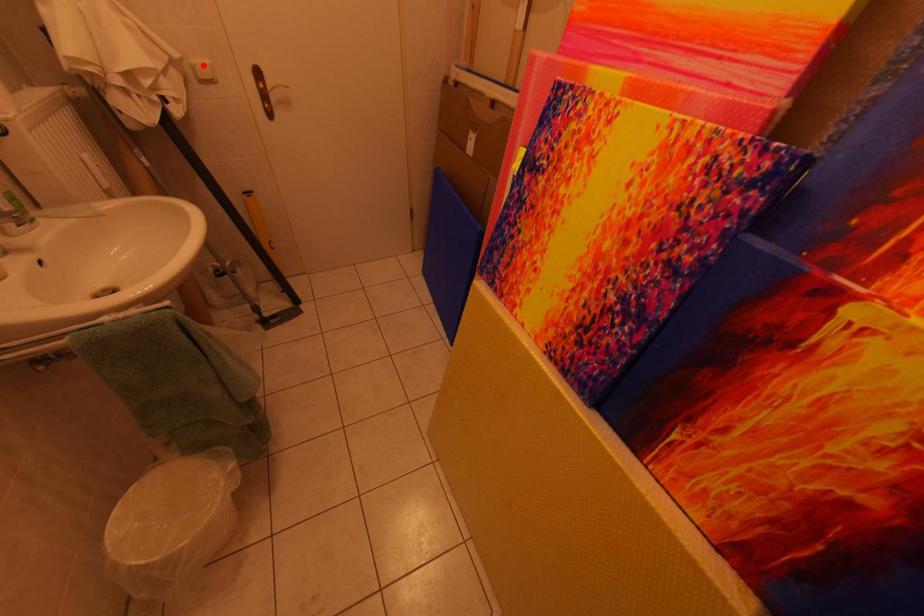
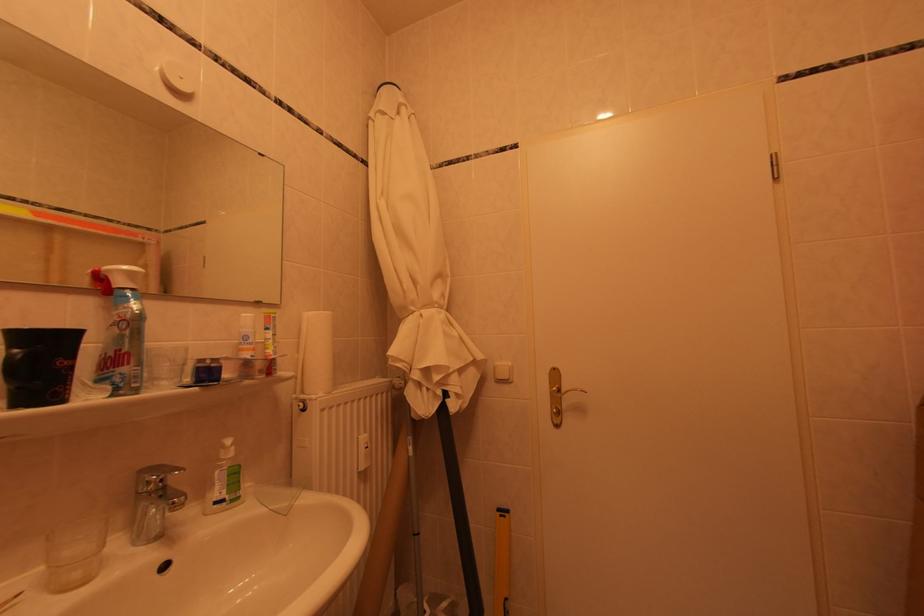
The point at the highlighted location is marked in the first image. Where is the corresponding point in the second image?

(506, 367)